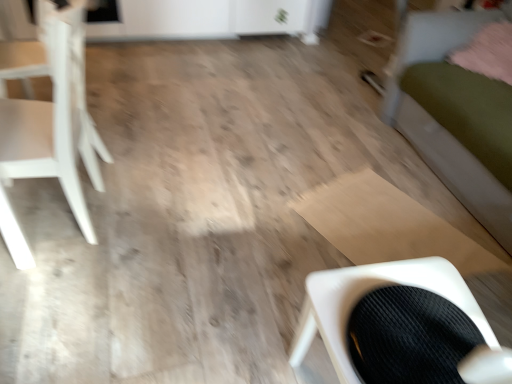
Find the location of `pink fluffy pillow at upper right`. pink fluffy pillow at upper right is located at coordinates tap(487, 52).

Identify the location of green fabric bed at right. The image size is (512, 384). (449, 112).

You are a GUI agent. You are given a task and a screenshot of the screen. Output one action in this format:
    pyautogui.click(x=<x>, y=<y>)
    Task: Click on the black corduroy chair at lower right, arranged as the 1th chair when viewed from the front
    This screenshot has width=512, height=384.
    Given the screenshot: What is the action you would take?
    pyautogui.click(x=365, y=293)

What's the angular difference between pink fluffy pillow at upper right and black corduroy chair at lower right, arranged as the 1th chair when viewed from the front,'s facing directions?

pink fluffy pillow at upper right and black corduroy chair at lower right, arranged as the 1th chair when viewed from the front, are facing 118 degrees away from each other.

From the image's perspective, relative to black corduroy chair at lower right, positioned as the 2th chair in back-to-front order, is pink fluffy pillow at upper right above or below?

From the image's perspective, pink fluffy pillow at upper right appears above black corduroy chair at lower right, positioned as the 2th chair in back-to-front order.

Would you say pink fluffy pillow at upper right is to the left or to the right of black corduroy chair at lower right, positioned as the 2th chair in back-to-front order, in the picture?

From the image, it's evident that pink fluffy pillow at upper right is to the right of black corduroy chair at lower right, positioned as the 2th chair in back-to-front order.

Looking at the image, does pink fluffy pillow at upper right seem bigger or smaller compared to black corduroy chair at lower right, acting as the 1th chair starting from the bottom?

Clearly, pink fluffy pillow at upper right is larger in size than black corduroy chair at lower right, acting as the 1th chair starting from the bottom.

In the scene shown: Would you say black corduroy chair at lower right, positioned as the 2th chair in back-to-front order, is outside green fabric bed at right?

black corduroy chair at lower right, positioned as the 2th chair in back-to-front order, lies outside green fabric bed at right's area.

Which of these two, black corduroy chair at lower right, positioned as the first chair in right-to-left order, or green fabric bed at right, is bigger?

With larger size is green fabric bed at right.

Between black corduroy chair at lower right, arranged as the 1th chair when viewed from the front, and green fabric bed at right, which one has smaller width?

black corduroy chair at lower right, arranged as the 1th chair when viewed from the front.

Is black corduroy chair at lower right, positioned as the 2th chair in back-to-front order, to the left of green fabric bed at right from the viewer's perspective?

Correct, you'll find black corduroy chair at lower right, positioned as the 2th chair in back-to-front order, to the left of green fabric bed at right.

Is green fabric bed at right facing towards black corduroy chair at lower right, acting as the 1th chair starting from the bottom?

Yes, green fabric bed at right is aimed at black corduroy chair at lower right, acting as the 1th chair starting from the bottom.

Who is bigger, green fabric bed at right or black corduroy chair at lower right, arranged as the 2th chair when viewed from the top?

green fabric bed at right.

This screenshot has height=384, width=512. Identify the location of bed behind the black corduroy chair at lower right, arranged as the 1th chair when viewed from the front. (449, 112).

Would you say green fabric bed at right is inside or outside black corduroy chair at lower right, positioned as the first chair in right-to-left order?

green fabric bed at right is not inside black corduroy chair at lower right, positioned as the first chair in right-to-left order, it's outside.

Between green fabric bed at right and white matte chair at left, which appears as the first chair when viewed from the top, which one has less height?

white matte chair at left, which appears as the first chair when viewed from the top.

Is point (445, 131) farther from camera compared to point (93, 156)?

Yes, point (445, 131) is behind point (93, 156).

From a real-world perspective, between green fabric bed at right and white matte chair at left, which appears as the first chair when viewed from the top, who is vertically higher?

green fabric bed at right, from a real-world perspective.

Based on the photo, is white matte chair at left, acting as the 2th chair starting from the right, a part of green fabric bed at right?

That's incorrect, white matte chair at left, acting as the 2th chair starting from the right, is not inside green fabric bed at right.

Which object is further away from the camera, white matte chair at left, the 2th chair from the bottom, or green fabric bed at right?

green fabric bed at right.

From the picture: Is white matte chair at left, which appears as the 1th chair when viewed from the back, aimed at green fabric bed at right?

No, white matte chair at left, which appears as the 1th chair when viewed from the back, is not oriented towards green fabric bed at right.

Which object is positioned more to the left, white matte chair at left, the second chair when ordered from front to back, or green fabric bed at right?

white matte chair at left, the second chair when ordered from front to back, is more to the left.

Are white matte chair at left, placed as the first chair when sorted from left to right, and pink fluffy pillow at upper right far apart?

Yes, white matte chair at left, placed as the first chair when sorted from left to right, and pink fluffy pillow at upper right are quite far apart.

From the picture: From a real-world perspective, which is physically below, white matte chair at left, which appears as the 1th chair when viewed from the back, or pink fluffy pillow at upper right?

white matte chair at left, which appears as the 1th chair when viewed from the back, from a real-world perspective.

How far apart are white matte chair at left, the second chair when ordered from front to back, and pink fluffy pillow at upper right?

They are 6.38 feet apart.

Which object is more forward, white matte chair at left, the second chair when ordered from front to back, or pink fluffy pillow at upper right?

Positioned in front is white matte chair at left, the second chair when ordered from front to back.

In the image, is black corduroy chair at lower right, arranged as the 1th chair when viewed from the front, positioned in front of or behind white matte chair at left, acting as the 2th chair starting from the right?

Clearly, black corduroy chair at lower right, arranged as the 1th chair when viewed from the front, is in front of white matte chair at left, acting as the 2th chair starting from the right.

Does black corduroy chair at lower right, acting as the 1th chair starting from the bottom, appear on the left side of white matte chair at left, acting as the 2th chair starting from the right?

Incorrect, black corduroy chair at lower right, acting as the 1th chair starting from the bottom, is not on the left side of white matte chair at left, acting as the 2th chair starting from the right.

From the image's perspective, which one is positioned lower, black corduroy chair at lower right, positioned as the first chair in right-to-left order, or white matte chair at left, which appears as the 1th chair when viewed from the back?

black corduroy chair at lower right, positioned as the first chair in right-to-left order, from the image's perspective.

Does point (302, 333) appear closer or farther from the camera than point (31, 107)?

Clearly, point (302, 333) is closer to the camera than point (31, 107).

From the pink fluffy pillow at upper right, count 2nd chairs forward and point to it. Please provide its 2D coordinates.

[(365, 293)]

You are a GUI agent. You are given a task and a screenshot of the screen. Output one action in this format:
    pyautogui.click(x=<x>, y=<y>)
    Task: Click on the bed on the right of black corduroy chair at lower right, which is the second chair in left-to-right order
    The width and height of the screenshot is (512, 384).
    Given the screenshot: What is the action you would take?
    pyautogui.click(x=449, y=112)

Estimate the real-world distances between objects in this image. Which object is further from green fabric bed at right, black corduroy chair at lower right, which is the second chair in left-to-right order, or pink fluffy pillow at upper right?

black corduroy chair at lower right, which is the second chair in left-to-right order, is further to green fabric bed at right.

From the image, which object appears to be farther from pink fluffy pillow at upper right, green fabric bed at right or black corduroy chair at lower right, arranged as the 1th chair when viewed from the front?

The object further to pink fluffy pillow at upper right is black corduroy chair at lower right, arranged as the 1th chair when viewed from the front.

When comparing their distances from black corduroy chair at lower right, positioned as the 2th chair in back-to-front order, does white matte chair at left, the 2th chair from the bottom, or green fabric bed at right seem further?

green fabric bed at right.

Looking at the image, which one is located further to pink fluffy pillow at upper right, green fabric bed at right or white matte chair at left, acting as the 2th chair starting from the right?

white matte chair at left, acting as the 2th chair starting from the right, is further to pink fluffy pillow at upper right.

Based on the photo, based on their spatial positions, is green fabric bed at right or pink fluffy pillow at upper right closer to black corduroy chair at lower right, positioned as the first chair in right-to-left order?

green fabric bed at right is positioned closer to the anchor black corduroy chair at lower right, positioned as the first chair in right-to-left order.

Estimate the real-world distances between objects in this image. Which object is closer to white matte chair at left, which appears as the first chair when viewed from the top, black corduroy chair at lower right, arranged as the 1th chair when viewed from the front, or green fabric bed at right?

Among the two, black corduroy chair at lower right, arranged as the 1th chair when viewed from the front, is located nearer to white matte chair at left, which appears as the first chair when viewed from the top.

Looking at the image, which one is located closer to green fabric bed at right, white matte chair at left, acting as the 2th chair starting from the right, or pink fluffy pillow at upper right?

pink fluffy pillow at upper right is closer to green fabric bed at right.

Which object lies nearer to the anchor point pink fluffy pillow at upper right, black corduroy chair at lower right, which is the second chair in left-to-right order, or white matte chair at left, acting as the 2th chair starting from the right?

black corduroy chair at lower right, which is the second chair in left-to-right order, is closer to pink fluffy pillow at upper right.

At what (x,y) coordinates should I click in order to perform the action: click on pillow between white matte chair at left, the second chair when ordered from front to back, and green fabric bed at right. Please return your answer as a coordinate pair (x, y). Looking at the image, I should click on (487, 52).

Locate an element on the screen. The image size is (512, 384). bed between black corduroy chair at lower right, positioned as the first chair in right-to-left order, and pink fluffy pillow at upper right from front to back is located at coordinates (449, 112).

Identify the location of chair between white matte chair at left, which appears as the 1th chair when viewed from the back, and green fabric bed at right, in the horizontal direction. (x=365, y=293).

Identify the location of chair between white matte chair at left, which appears as the first chair when viewed from the top, and pink fluffy pillow at upper right from left to right. coord(365,293).